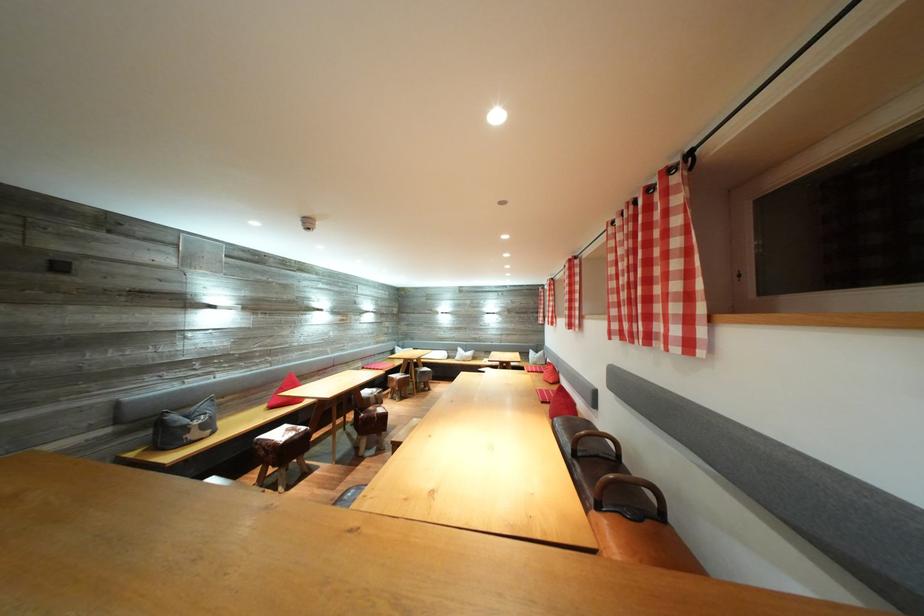
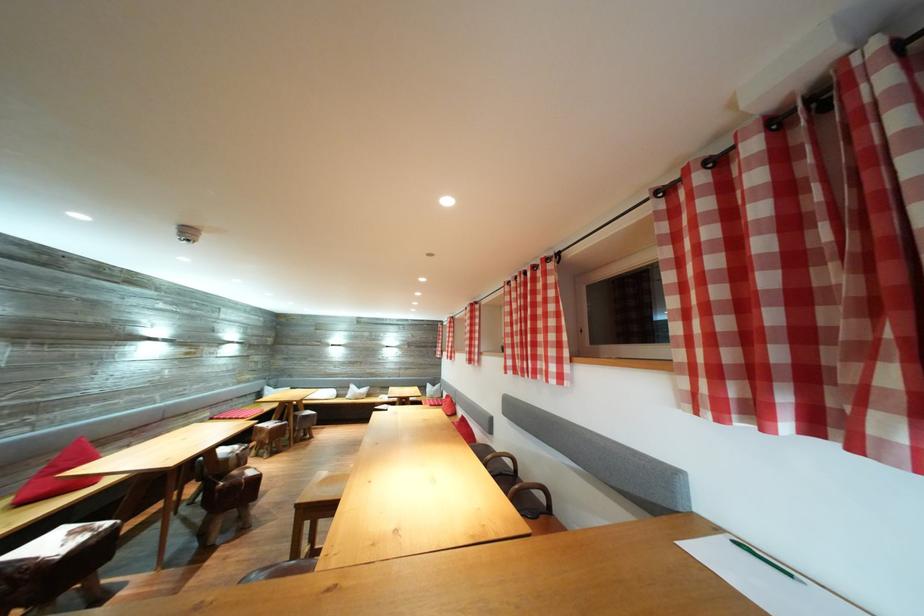
The point at (622,331) is marked in the first image. Where is the corresponding point in the second image?

(517, 368)